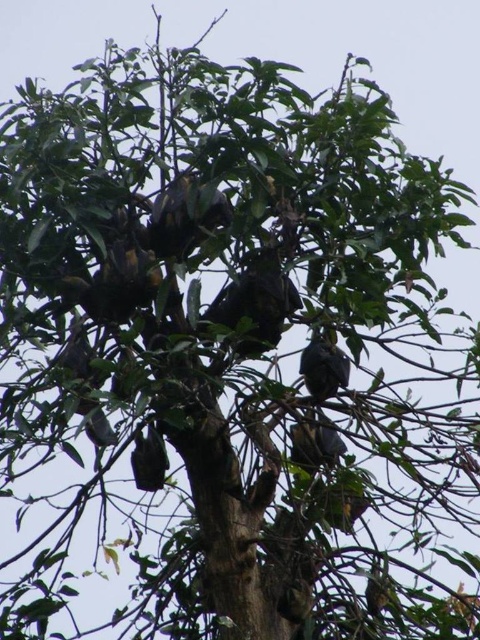
You are standing in front of the tree and notice two points marked on the tree. One is at point (269, 320) and the other at point (316, 333). Which point is closer to you?

Point (269, 320) is in front of point (316, 333), so it is closer to you.

You are a wildlife researcher observing the tree from the ground. You notice a point marked at coordinates (324, 365). Which bat in the tree is located at this point?

The point at (324, 365) corresponds to the dark gray fur bat at center.

You are observing a tree with bats and other creatures. There is a dark brown fur bat at center and a dark gray feathers at center. Which one appears closer to you?

The dark brown fur bat at center is closer to the viewer than the dark gray feathers at center.